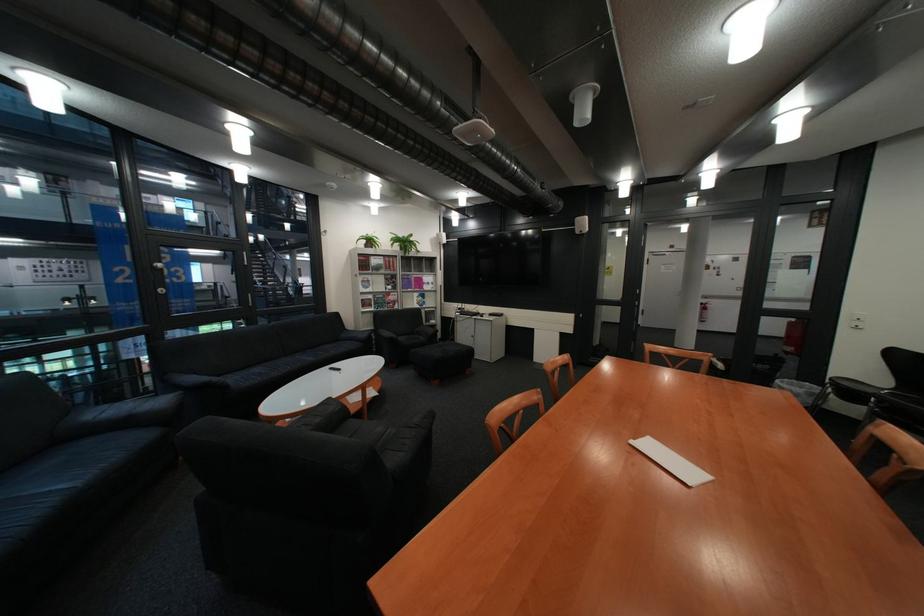
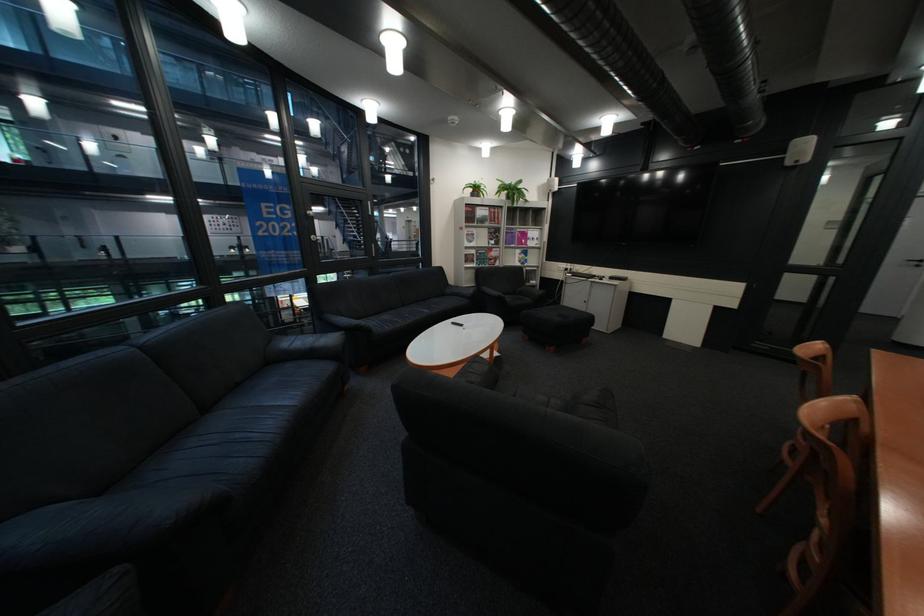
Question: I am providing you with two images of the same scene from different viewpoints. Please identify which objects are invisible in image2.

Choices:
 (A) black sofa armrest
 (B) door handle
 (C) white remote control
 (D) none of these

Answer: (D)